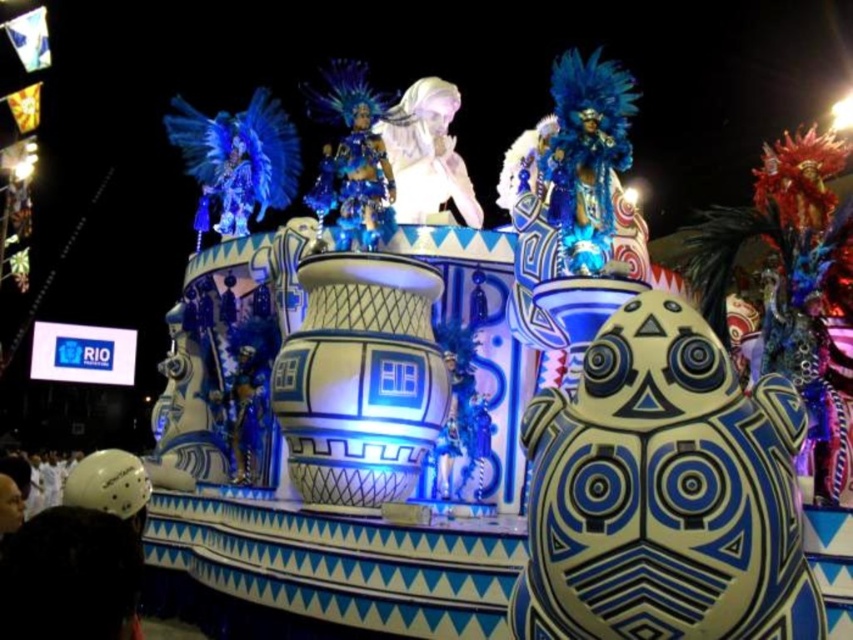
Consider the image. Is white glossy mask at center below sparkly blue costume at center?

Incorrect, white glossy mask at center is not positioned below sparkly blue costume at center.

Which of these two, white glossy mask at center or sparkly blue costume at center, stands shorter?

Standing shorter between the two is sparkly blue costume at center.

You are a GUI agent. You are given a task and a screenshot of the screen. Output one action in this format:
    pyautogui.click(x=<x>, y=<y>)
    Task: Click on the white glossy mask at center
    
    Given the screenshot: What is the action you would take?
    pyautogui.click(x=426, y=154)

Is white glossy mask at center taller than white matte helmet at lower left?

Yes.

Where is `white glossy mask at center`? Image resolution: width=853 pixels, height=640 pixels. white glossy mask at center is located at coordinates (426, 154).

Does point (347, 148) come in front of point (84, 472)?

That is False.

Is point (363, 115) behind point (0, 509)?

Yes, it is.

Locate an element on the screen. sparkly blue costume at center is located at coordinates (360, 180).